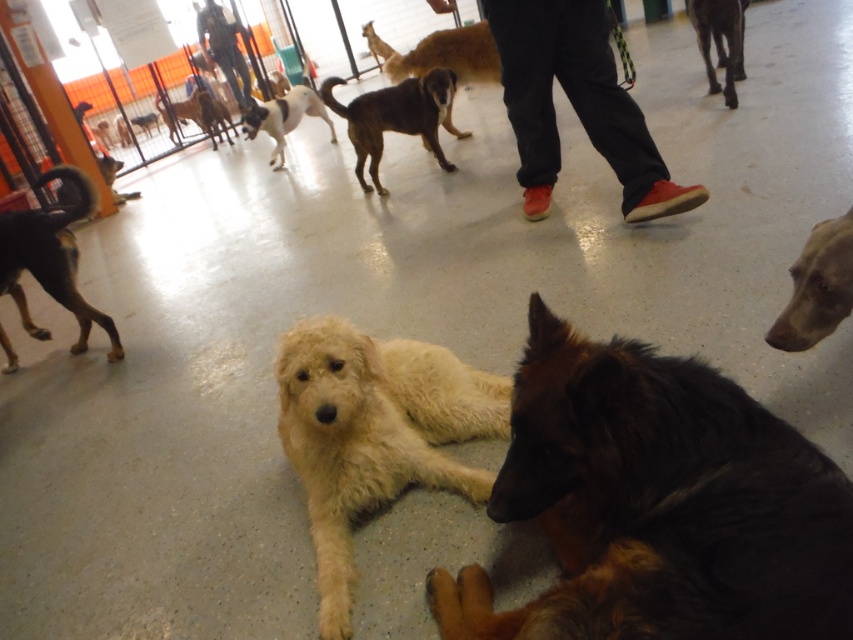
You are a visitor at the dog daycare and you see the red canvas shoes at center and the brown shaggy dog at center. Which object is taller?

The brown shaggy dog at center is taller than the red canvas shoes at center.

You are a visitor standing in the daycare and want to pet both the brown shaggy dog at center and the white fluffy dog at upper center. Which dog should you approach first to reach the closer one?

The brown shaggy dog at center is closer to the viewer than the white fluffy dog at upper center, so you should approach the brown shaggy dog at center first.

You are standing at the entrance of the dog daycare and want to walk towards the point labeled as point (231, 38). However, there is an obstacle at point (213, 122). Will you collide with the obstacle if you walk straight ahead?

Point (231, 38) is in front of point (213, 122), so walking straight towards point (231, 38) would mean you are moving away from the obstacle at point (213, 122). Therefore, you will not collide with the obstacle.